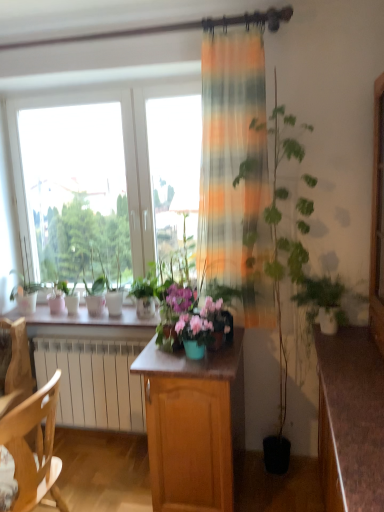
Question: From a real-world perspective, does brown wood desk at lower right sit lower than green matte plant at right?

Choices:
 (A) yes
 (B) no

Answer: (A)

Question: Can you confirm if brown wood desk at lower right is positioned to the right of green matte plant at right?

Choices:
 (A) no
 (B) yes

Answer: (B)

Question: Is brown wood desk at lower right further to the viewer compared to green matte plant at right?

Choices:
 (A) yes
 (B) no

Answer: (B)

Question: From a real-world perspective, is brown wood desk at lower right on top of green matte plant at right?

Choices:
 (A) no
 (B) yes

Answer: (A)

Question: Is brown wood desk at lower right not near green matte plant at right?

Choices:
 (A) no
 (B) yes

Answer: (A)

Question: From a real-world perspective, is matte plastic flower box at center physically located above or below brown wood desk at lower right?

Choices:
 (A) above
 (B) below

Answer: (A)

Question: Is point (198, 316) closer or farther from the camera than point (354, 506)?

Choices:
 (A) farther
 (B) closer

Answer: (A)

Question: Considering the relative positions of matte plastic flower box at center and brown wood desk at lower right in the image provided, is matte plastic flower box at center to the left or to the right of brown wood desk at lower right?

Choices:
 (A) right
 (B) left

Answer: (B)

Question: From the image's perspective, is matte plastic flower box at center above or below brown wood desk at lower right?

Choices:
 (A) below
 (B) above

Answer: (B)

Question: Considering the positions of green matte plant at right and wooden chair at lower left in the image, is green matte plant at right taller or shorter than wooden chair at lower left?

Choices:
 (A) tall
 (B) short

Answer: (B)

Question: Considering the positions of point (362, 297) and point (54, 395), is point (362, 297) closer or farther from the camera than point (54, 395)?

Choices:
 (A) farther
 (B) closer

Answer: (B)

Question: Based on their sizes in the image, would you say green matte plant at right is bigger or smaller than wooden chair at lower left?

Choices:
 (A) small
 (B) big

Answer: (A)

Question: Choose the correct answer: Is green matte plant at right inside wooden chair at lower left or outside it?

Choices:
 (A) outside
 (B) inside

Answer: (A)

Question: In the image, is white glossy window sill at center positioned in front of or behind matte plastic flower box at center?

Choices:
 (A) behind
 (B) front

Answer: (A)

Question: Is white glossy window sill at center to the left or to the right of matte plastic flower box at center in the image?

Choices:
 (A) left
 (B) right

Answer: (A)